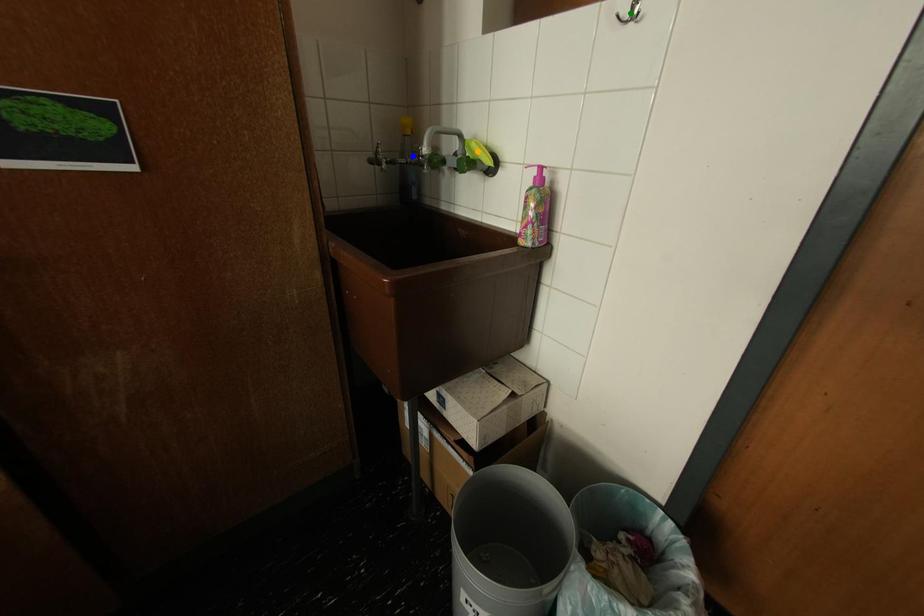
Order these from nearest to farthest:
- orange point
- green point
- blue point

green point < orange point < blue point